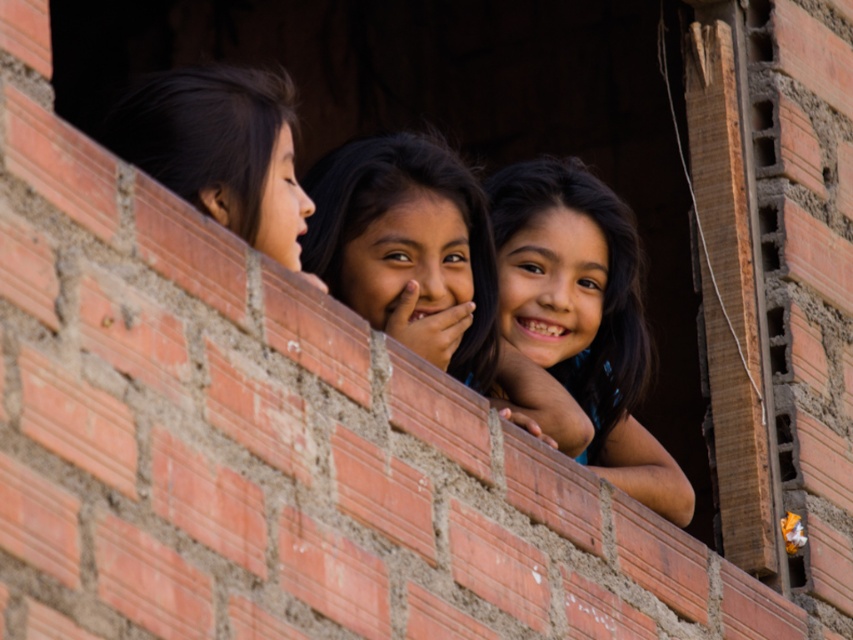
Between dark brown hair at center and black hair at left, which one has less height?

Standing shorter between the two is black hair at left.

Where is `dark brown hair at center`? dark brown hair at center is located at coordinates click(x=583, y=314).

Is smooth skin child at center below dark brown hair at center?

Incorrect, smooth skin child at center is not positioned below dark brown hair at center.

Which of these two, smooth skin child at center or dark brown hair at center, stands shorter?

Standing shorter between the two is smooth skin child at center.

The width and height of the screenshot is (853, 640). What do you see at coordinates (426, 269) in the screenshot? I see `smooth skin child at center` at bounding box center [426, 269].

Image resolution: width=853 pixels, height=640 pixels. I want to click on smooth skin child at center, so coord(426,269).

Is smooth skin child at center below black hair at left?

Yes, smooth skin child at center is below black hair at left.

Is smooth skin child at center bigger than black hair at left?

No, smooth skin child at center is not bigger than black hair at left.

Describe the element at coordinates (426, 269) in the screenshot. I see `smooth skin child at center` at that location.

At what (x,y) coordinates should I click in order to perform the action: click on smooth skin child at center. Please return your answer as a coordinate pair (x, y). This screenshot has width=853, height=640. Looking at the image, I should click on (426, 269).